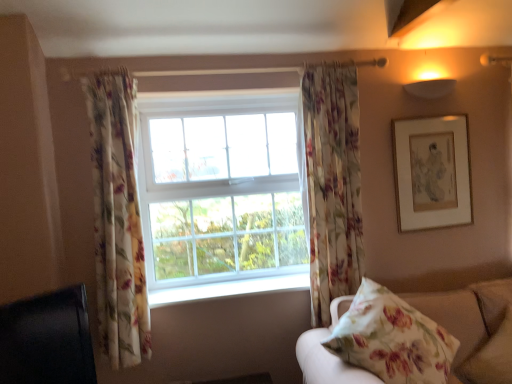
The height and width of the screenshot is (384, 512). Identify the location of white smooth window sill at center. (228, 288).

The image size is (512, 384). Describe the element at coordinates (391, 338) in the screenshot. I see `floral fabric pillow at lower right` at that location.

Describe the element at coordinates (47, 339) in the screenshot. I see `black glossy tv at lower left` at that location.

This screenshot has height=384, width=512. I want to click on gold-framed artwork at upper right, so click(x=432, y=172).

What do you see at coordinates (331, 183) in the screenshot? I see `floral fabric curtain at center, arranged as the second curtain when viewed from the left` at bounding box center [331, 183].

I want to click on white smooth window sill at center, so click(228, 288).

Who is more distant, white smooth window sill at center or floral fabric pillow at lower right?

white smooth window sill at center is further from the camera.

Is white smooth window sill at center at the left side of floral fabric pillow at lower right?

Yes, white smooth window sill at center is to the left of floral fabric pillow at lower right.

Is point (234, 289) closer to viewer compared to point (421, 373)?

No, it is behind (421, 373).

Based on the photo, is gold-framed artwork at upper right further to the viewer compared to white smooth window sill at center?

Yes.

From the picture: Would you say gold-framed artwork at upper right is outside white smooth window sill at center?

Yes, gold-framed artwork at upper right is not within white smooth window sill at center.

What are the coordinates of `picture frame located above the white smooth window sill at center (from the image's perspective)` in the screenshot? It's located at (432, 172).

From the picture: From a real-world perspective, is gold-framed artwork at upper right physically above white smooth window sill at center?

Yes, from a real-world perspective, gold-framed artwork at upper right is on top of white smooth window sill at center.

Which is correct: black glossy tv at lower left is inside white smooth window sill at center, or outside of it?

black glossy tv at lower left is spatially situated outside white smooth window sill at center.

Who is shorter, black glossy tv at lower left or white smooth window sill at center?

Standing shorter between the two is white smooth window sill at center.

Between black glossy tv at lower left and white smooth window sill at center, which one has smaller size?

white smooth window sill at center is smaller.

From the image's perspective, which is below, black glossy tv at lower left or white smooth window sill at center?

black glossy tv at lower left, from the image's perspective.

Consider the image. Is white glass window at center completely or partially outside of black glossy tv at lower left?

white glass window at center is positioned outside black glossy tv at lower left.

Considering the points (252, 138) and (60, 375), which point is in front, point (252, 138) or point (60, 375)?

The point (60, 375) is more forward.

Looking at this image, from the image's perspective, who appears lower, white glass window at center or black glossy tv at lower left?

black glossy tv at lower left, from the image's perspective.

Considering the relative sizes of white glass window at center and black glossy tv at lower left in the image provided, is white glass window at center taller than black glossy tv at lower left?

Yes, white glass window at center is taller than black glossy tv at lower left.

Does floral fabric pillow at lower right have a larger size compared to white smooth window sill at center?

Indeed, floral fabric pillow at lower right has a larger size compared to white smooth window sill at center.

You are a GUI agent. You are given a task and a screenshot of the screen. Output one action in this format:
    pyautogui.click(x=<x>, y=<y>)
    Task: Click on the window sill behind the floral fabric pillow at lower right
    This screenshot has width=512, height=384.
    Given the screenshot: What is the action you would take?
    pyautogui.click(x=228, y=288)

From a real-world perspective, is floral fabric pillow at lower right physically below white smooth window sill at center?

Yes.

From a real-world perspective, which is physically above, floral fabric curtain at left, positioned as the second curtain in right-to-left order, or black glossy tv at lower left?

floral fabric curtain at left, positioned as the second curtain in right-to-left order.

Between floral fabric curtain at left, positioned as the second curtain in right-to-left order, and black glossy tv at lower left, which one is positioned in front?

Positioned in front is black glossy tv at lower left.

Would you say black glossy tv at lower left is part of floral fabric curtain at left, positioned as the second curtain in right-to-left order,'s contents?

No, floral fabric curtain at left, positioned as the second curtain in right-to-left order, does not contain black glossy tv at lower left.

From the image's perspective, is floral fabric curtain at left, which appears as the 1th curtain when viewed from the left, on black glossy tv at lower left?

Indeed, from the image's perspective, floral fabric curtain at left, which appears as the 1th curtain when viewed from the left, is shown above black glossy tv at lower left.

Considering the sizes of objects black glossy tv at lower left and gold-framed artwork at upper right in the image provided, who is shorter, black glossy tv at lower left or gold-framed artwork at upper right?

black glossy tv at lower left.

Is the position of black glossy tv at lower left more distant than that of gold-framed artwork at upper right?

No, it is not.

Is black glossy tv at lower left oriented away from gold-framed artwork at upper right?

That's not correct — black glossy tv at lower left is not looking away from gold-framed artwork at upper right.

From a real-world perspective, is black glossy tv at lower left positioned above or below gold-framed artwork at upper right?

black glossy tv at lower left is situated lower than gold-framed artwork at upper right in the real world.

This screenshot has width=512, height=384. Find the location of `pillow located in front of the white smooth window sill at center`. pillow located in front of the white smooth window sill at center is located at coordinates (391, 338).

Identify the location of window sill on the left of the gold-framed artwork at upper right. [228, 288].

Considering their positions, is white glass window at center positioned closer to floral fabric curtain at center, positioned as the 1th curtain in right-to-left order, than floral fabric curtain at left, positioned as the second curtain in right-to-left order?

white glass window at center lies closer to floral fabric curtain at center, positioned as the 1th curtain in right-to-left order, than the other object.

Estimate the real-world distances between objects in this image. Which object is closer to gold-framed artwork at upper right, floral fabric curtain at center, positioned as the 1th curtain in right-to-left order, or black glossy tv at lower left?

floral fabric curtain at center, positioned as the 1th curtain in right-to-left order, lies closer to gold-framed artwork at upper right than the other object.

Considering their positions, is white glass window at center positioned further to floral fabric curtain at center, arranged as the second curtain when viewed from the left, than black glossy tv at lower left?

Among the two, black glossy tv at lower left is located further to floral fabric curtain at center, arranged as the second curtain when viewed from the left.

Estimate the real-world distances between objects in this image. Which object is closer to white smooth window sill at center, floral fabric pillow at lower right or black glossy tv at lower left?

The object closer to white smooth window sill at center is black glossy tv at lower left.

From the image, which object appears to be nearer to floral fabric curtain at left, which appears as the 1th curtain when viewed from the left, gold-framed artwork at upper right or black glossy tv at lower left?

black glossy tv at lower left is closer to floral fabric curtain at left, which appears as the 1th curtain when viewed from the left.

Based on their spatial positions, is floral fabric pillow at lower right or white glass window at center further from floral fabric curtain at left, positioned as the second curtain in right-to-left order?

→ Among the two, floral fabric pillow at lower right is located further to floral fabric curtain at left, positioned as the second curtain in right-to-left order.

When comparing their distances from gold-framed artwork at upper right, does white smooth window sill at center or floral fabric curtain at center, arranged as the second curtain when viewed from the left, seem closer?

floral fabric curtain at center, arranged as the second curtain when viewed from the left, lies closer to gold-framed artwork at upper right than the other object.

From the image, which object appears to be nearer to floral fabric curtain at center, positioned as the 1th curtain in right-to-left order, white glass window at center or gold-framed artwork at upper right?

The object closer to floral fabric curtain at center, positioned as the 1th curtain in right-to-left order, is white glass window at center.

The image size is (512, 384). Find the location of `bay window between black glossy tv at lower left and floral fabric pillow at lower right in the horizontal direction`. bay window between black glossy tv at lower left and floral fabric pillow at lower right in the horizontal direction is located at coordinates (220, 188).

The width and height of the screenshot is (512, 384). I want to click on bay window located between floral fabric curtain at left, positioned as the second curtain in right-to-left order, and gold-framed artwork at upper right in the left-right direction, so click(220, 188).

The height and width of the screenshot is (384, 512). I want to click on curtain located between floral fabric curtain at left, which appears as the 1th curtain when viewed from the left, and gold-framed artwork at upper right in the left-right direction, so click(x=331, y=183).

Locate an element on the screen. The height and width of the screenshot is (384, 512). curtain between black glossy tv at lower left and floral fabric curtain at center, arranged as the second curtain when viewed from the left, in the horizontal direction is located at coordinates click(117, 219).